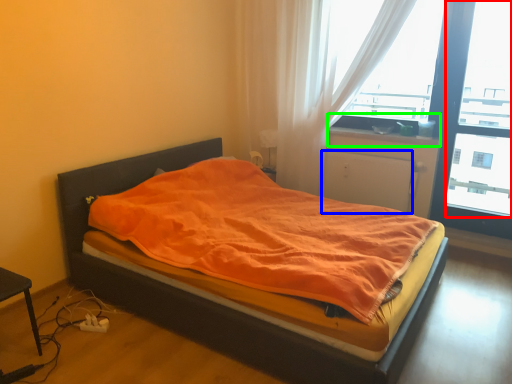
Question: Which object is positioned closest to window screen (highlighted by a red box)? Select from screen door (highlighted by a blue box) and window sill (highlighted by a green box).

Choices:
 (A) screen door
 (B) window sill

Answer: (A)